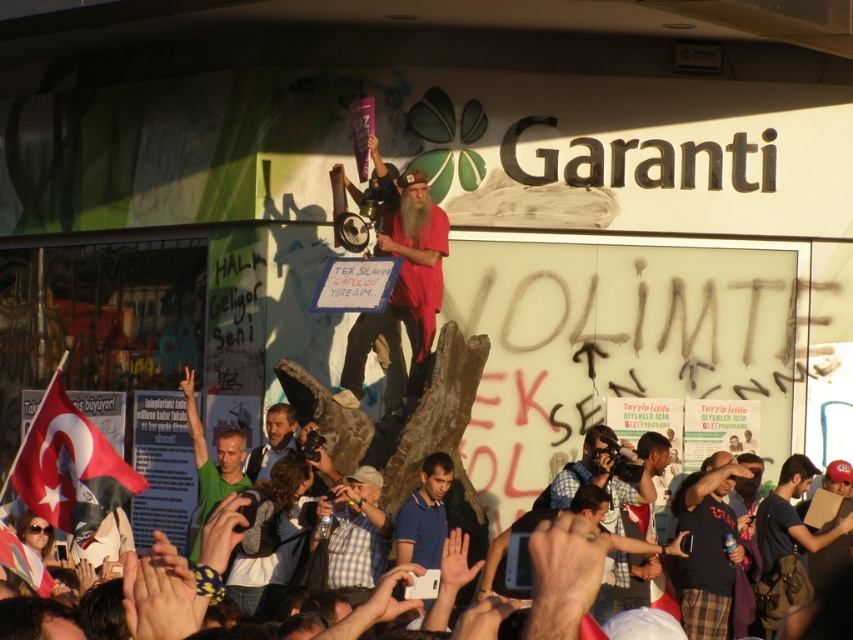
Is white fabric flag at lower left smaller than checkered fabric shirt at center?

Actually, white fabric flag at lower left might be larger than checkered fabric shirt at center.

The height and width of the screenshot is (640, 853). Describe the element at coordinates (68, 467) in the screenshot. I see `white fabric flag at lower left` at that location.

Identify the location of white fabric flag at lower left. The height and width of the screenshot is (640, 853). (68, 467).

Is red matte sign at center to the right of green matte shirt at lower left from the viewer's perspective?

Yes, red matte sign at center is to the right of green matte shirt at lower left.

I want to click on red matte sign at center, so click(x=401, y=280).

Identify the location of red matte sign at center. Image resolution: width=853 pixels, height=640 pixels. point(401,280).

Does checkered fabric shirt at center appear under green matte shirt at lower left?

Indeed, checkered fabric shirt at center is positioned under green matte shirt at lower left.

Where is `checkered fabric shirt at center`? This screenshot has height=640, width=853. checkered fabric shirt at center is located at coordinates (355, 532).

Describe the element at coordinates (355, 532) in the screenshot. This screenshot has height=640, width=853. I see `checkered fabric shirt at center` at that location.

The width and height of the screenshot is (853, 640). In order to click on checkered fabric shirt at center in this screenshot , I will do `click(355, 532)`.